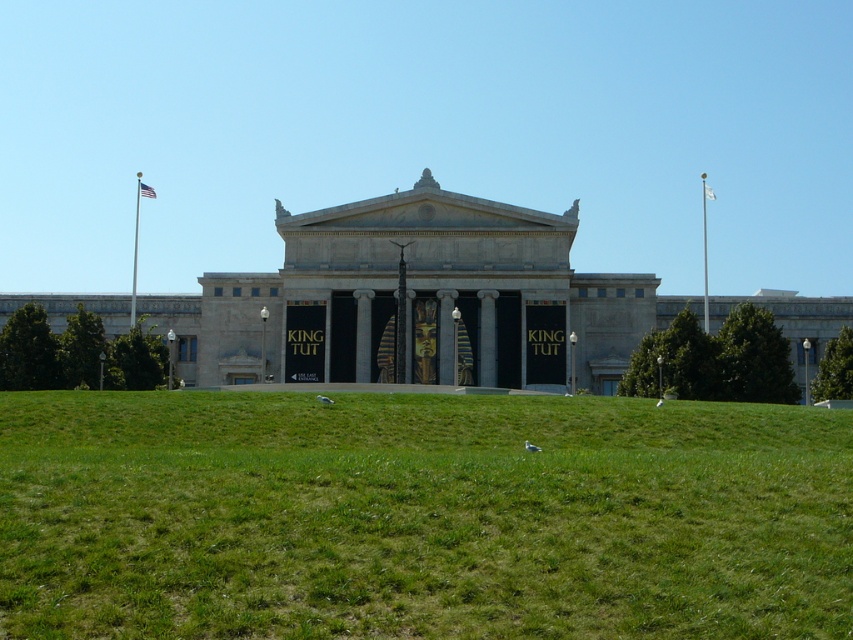
Question: Which point is farther from the camera taking this photo?

Choices:
 (A) (229, 634)
 (B) (706, 186)
 (C) (137, 179)

Answer: (C)

Question: Which point is farther to the camera?

Choices:
 (A) metallic flag pole at upper center
 (B) green grass at lower center
 (C) metallic flag pole at left

Answer: (C)

Question: Among these points, which one is nearest to the camera?

Choices:
 (A) (634, 625)
 (B) (708, 196)

Answer: (A)

Question: Observing the image, what is the correct spatial positioning of metallic flag pole at left in reference to metallic flag pole at upper center?

Choices:
 (A) right
 (B) left

Answer: (B)

Question: Is metallic flag pole at left to the right of metallic flag pole at upper center from the viewer's perspective?

Choices:
 (A) yes
 (B) no

Answer: (B)

Question: Can you confirm if green grass at lower center is thinner than metallic flag pole at left?

Choices:
 (A) no
 (B) yes

Answer: (A)